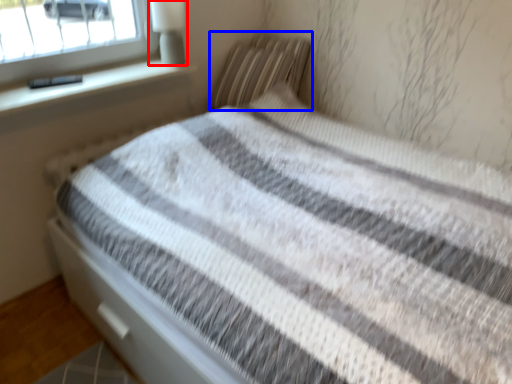
Question: Which of the following is the closest to the observer, lamp (highlighted by a red box) or pillow (highlighted by a blue box)?

Choices:
 (A) lamp
 (B) pillow

Answer: (A)